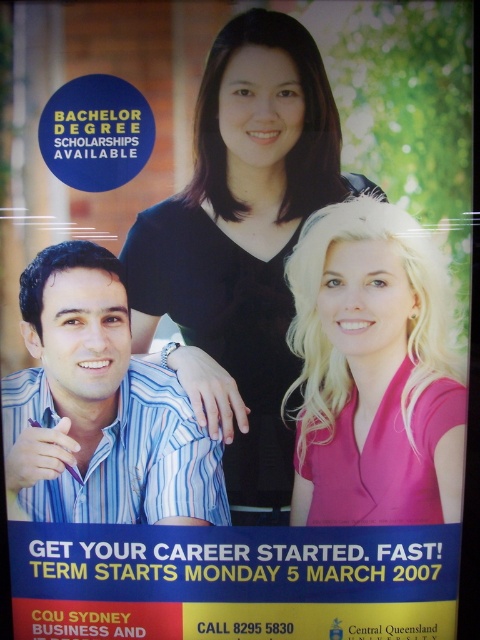
Question: Does pink satin blouse at right come in front of blue striped shirt at lower left?

Choices:
 (A) no
 (B) yes

Answer: (B)

Question: Is black matte shirt at center positioned in front of blue striped shirt at lower left?

Choices:
 (A) no
 (B) yes

Answer: (B)

Question: Which object appears farthest from the camera in this image?

Choices:
 (A) pink satin blouse at right
 (B) blue striped shirt at lower left
 (C) black matte shirt at center

Answer: (B)

Question: Which of these objects is positioned farthest from the black matte shirt at center?

Choices:
 (A) pink satin blouse at right
 (B) blue striped shirt at lower left

Answer: (B)

Question: Can you confirm if black matte shirt at center is positioned above pink satin blouse at right?

Choices:
 (A) no
 (B) yes

Answer: (B)

Question: Which is nearer to the black matte shirt at center?

Choices:
 (A) pink satin blouse at right
 (B) blue striped shirt at lower left

Answer: (A)